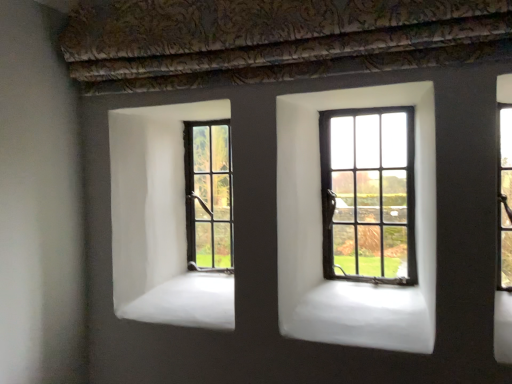
Describe the element at coordinates (368, 194) in the screenshot. I see `dark brown wooden window at center, acting as the second window starting from the left` at that location.

Measure the distance between dark brown wooden window at center, marked as the 1th window in a right-to-left arrangement, and camera.

dark brown wooden window at center, marked as the 1th window in a right-to-left arrangement, is 4.52 feet away from camera.

The height and width of the screenshot is (384, 512). In order to click on dark brown wooden window at center, which is counted as the 1th window, starting from the front in this screenshot , I will do `click(368, 194)`.

Identify the location of dark brown wooden window at center left, the 2th window from the right. (208, 195).

The height and width of the screenshot is (384, 512). What do you see at coordinates (208, 195) in the screenshot? I see `dark brown wooden window at center left, the 2th window from the front` at bounding box center [208, 195].

Measure the distance between point (206, 151) and camera.

Point (206, 151) is 1.71 meters away from camera.

You are a GUI agent. You are given a task and a screenshot of the screen. Output one action in this format:
    pyautogui.click(x=<x>, y=<y>)
    Task: Click on the dark brown wooden window at center, which ranks as the 2th window in back-to-front order
    The width and height of the screenshot is (512, 384).
    Given the screenshot: What is the action you would take?
    pyautogui.click(x=368, y=194)

Considering the positions of objects dark brown wooden window at center left, the 2th window from the front, and dark brown wooden window at center, acting as the second window starting from the left, in the image provided, who is more to the right, dark brown wooden window at center left, the 2th window from the front, or dark brown wooden window at center, acting as the second window starting from the left,?

dark brown wooden window at center, acting as the second window starting from the left, is more to the right.

Which object is further away from the camera, dark brown wooden window at center left, the 2th window from the front, or dark brown wooden window at center, which ranks as the 2th window in back-to-front order?

dark brown wooden window at center left, the 2th window from the front, is further from the camera.

Considering the positions of point (214, 185) and point (338, 183), is point (214, 185) closer or farther from the camera than point (338, 183)?

Point (214, 185) is farther from the camera than point (338, 183).

From the image's perspective, is dark brown wooden window at center left, the 2th window from the right, over dark brown wooden window at center, acting as the second window starting from the left?

No, from the image's perspective, dark brown wooden window at center left, the 2th window from the right, is not above dark brown wooden window at center, acting as the second window starting from the left.

From a real-world perspective, is dark brown wooden window at center left, the 1th window when ordered from back to front, physically located above or below dark brown wooden window at center, marked as the 1th window in a right-to-left arrangement?

In terms of real-world spatial position, dark brown wooden window at center left, the 1th window when ordered from back to front, is below dark brown wooden window at center, marked as the 1th window in a right-to-left arrangement.

Considering the relative sizes of dark brown wooden window at center left, the 2th window from the front, and dark brown wooden window at center, acting as the second window starting from the left, in the image provided, is dark brown wooden window at center left, the 2th window from the front, wider than dark brown wooden window at center, acting as the second window starting from the left,?

No.

Which of these two, dark brown wooden window at center left, the 2th window from the front, or dark brown wooden window at center, marked as the 1th window in a right-to-left arrangement, stands taller?

dark brown wooden window at center, marked as the 1th window in a right-to-left arrangement, is taller.

Does dark brown wooden window at center left, marked as the 1th window in a left-to-right arrangement, have a larger size compared to dark brown wooden window at center, marked as the 1th window in a right-to-left arrangement?

Actually, dark brown wooden window at center left, marked as the 1th window in a left-to-right arrangement, might be smaller than dark brown wooden window at center, marked as the 1th window in a right-to-left arrangement.

Could dark brown wooden window at center, which ranks as the 2th window in back-to-front order, be considered to be inside dark brown wooden window at center left, marked as the 1th window in a left-to-right arrangement?

No, dark brown wooden window at center, which ranks as the 2th window in back-to-front order, is not inside dark brown wooden window at center left, marked as the 1th window in a left-to-right arrangement.

Is dark brown wooden window at center left, the 2th window from the right, with dark brown wooden window at center, which ranks as the 2th window in back-to-front order?

No, dark brown wooden window at center left, the 2th window from the right, is not in contact with dark brown wooden window at center, which ranks as the 2th window in back-to-front order.

Is dark brown wooden window at center, acting as the second window starting from the left, at the back of dark brown wooden window at center left, the 1th window when ordered from back to front?

dark brown wooden window at center left, the 1th window when ordered from back to front, is not turned away from dark brown wooden window at center, acting as the second window starting from the left.

How different are the orientations of dark brown wooden window at center left, marked as the 1th window in a left-to-right arrangement, and dark brown wooden window at center, acting as the second window starting from the left, in degrees?

They differ by 0.805 degrees in their facing directions.

Where is `window located behind the dark brown wooden window at center, which ranks as the 2th window in back-to-front order`? This screenshot has height=384, width=512. window located behind the dark brown wooden window at center, which ranks as the 2th window in back-to-front order is located at coordinates (208, 195).

Is dark brown wooden window at center, which ranks as the 2th window in back-to-front order, at the right side of dark brown wooden window at center left, the 2th window from the front?

Yes, dark brown wooden window at center, which ranks as the 2th window in back-to-front order, is to the right of dark brown wooden window at center left, the 2th window from the front.

Between dark brown wooden window at center, marked as the 1th window in a right-to-left arrangement, and dark brown wooden window at center left, marked as the 1th window in a left-to-right arrangement, which one is positioned behind?

dark brown wooden window at center left, marked as the 1th window in a left-to-right arrangement, is more distant.

Considering the points (332, 141) and (200, 234), which point is behind, point (332, 141) or point (200, 234)?

The point (200, 234) is farther from the camera.

From the image's perspective, is dark brown wooden window at center, which ranks as the 2th window in back-to-front order, located above dark brown wooden window at center left, marked as the 1th window in a left-to-right arrangement?

Yes, from the image's perspective, dark brown wooden window at center, which ranks as the 2th window in back-to-front order, is on top of dark brown wooden window at center left, marked as the 1th window in a left-to-right arrangement.

From a real-world perspective, is dark brown wooden window at center, which is counted as the 1th window, starting from the front, positioned over dark brown wooden window at center left, the 2th window from the right, based on gravity?

Yes, from a real-world perspective, dark brown wooden window at center, which is counted as the 1th window, starting from the front, is above dark brown wooden window at center left, the 2th window from the right.

Looking at their sizes, would you say dark brown wooden window at center, acting as the second window starting from the left, is wider or thinner than dark brown wooden window at center left, marked as the 1th window in a left-to-right arrangement?

Considering their sizes, dark brown wooden window at center, acting as the second window starting from the left, looks broader than dark brown wooden window at center left, marked as the 1th window in a left-to-right arrangement.

Considering the relative sizes of dark brown wooden window at center, acting as the second window starting from the left, and dark brown wooden window at center left, marked as the 1th window in a left-to-right arrangement, in the image provided, is dark brown wooden window at center, acting as the second window starting from the left, taller than dark brown wooden window at center left, marked as the 1th window in a left-to-right arrangement,?

Indeed, dark brown wooden window at center, acting as the second window starting from the left, has a greater height compared to dark brown wooden window at center left, marked as the 1th window in a left-to-right arrangement.

Between dark brown wooden window at center, which ranks as the 2th window in back-to-front order, and dark brown wooden window at center left, marked as the 1th window in a left-to-right arrangement, which one has smaller size?

With smaller size is dark brown wooden window at center left, marked as the 1th window in a left-to-right arrangement.

Is dark brown wooden window at center, acting as the second window starting from the left, completely or partially outside of dark brown wooden window at center left, marked as the 1th window in a left-to-right arrangement?

Absolutely, dark brown wooden window at center, acting as the second window starting from the left, is external to dark brown wooden window at center left, marked as the 1th window in a left-to-right arrangement.

Based on the photo, can you see dark brown wooden window at center, acting as the second window starting from the left, touching dark brown wooden window at center left, the 2th window from the right?

No, dark brown wooden window at center, acting as the second window starting from the left, is not next to dark brown wooden window at center left, the 2th window from the right.

Is dark brown wooden window at center, acting as the second window starting from the left, aimed at dark brown wooden window at center left, the 2th window from the right?

No, dark brown wooden window at center, acting as the second window starting from the left, is not aimed at dark brown wooden window at center left, the 2th window from the right.

How much distance is there between dark brown wooden window at center, which is counted as the 1th window, starting from the front, and dark brown wooden window at center left, the 2th window from the front?

The distance of dark brown wooden window at center, which is counted as the 1th window, starting from the front, from dark brown wooden window at center left, the 2th window from the front, is 20.67 inches.

Image resolution: width=512 pixels, height=384 pixels. In order to click on window that appears above the dark brown wooden window at center left, the 2th window from the front (from a real-world perspective) in this screenshot , I will do `click(368, 194)`.

The height and width of the screenshot is (384, 512). In order to click on window lying on the left of dark brown wooden window at center, marked as the 1th window in a right-to-left arrangement in this screenshot , I will do `click(208, 195)`.

The image size is (512, 384). Identify the location of window behind the dark brown wooden window at center, acting as the second window starting from the left. (208, 195).